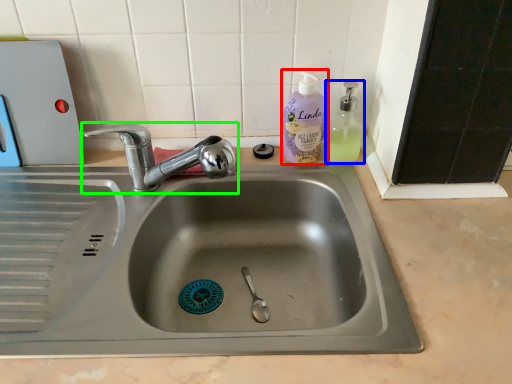
Question: Based on their relative distances, which object is farther from cleaning product (highlighted by a red box)? Choose from soap dispenser (highlighted by a blue box) and tap (highlighted by a green box).

Choices:
 (A) soap dispenser
 (B) tap

Answer: (B)